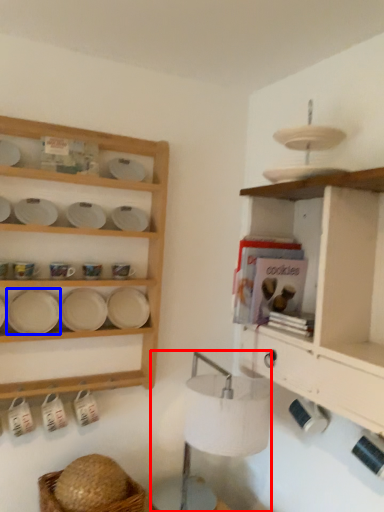
Question: Which object appears farthest to the camera in this image, lamp (highlighted by a red box) or platter (highlighted by a blue box)?

Choices:
 (A) lamp
 (B) platter

Answer: (B)